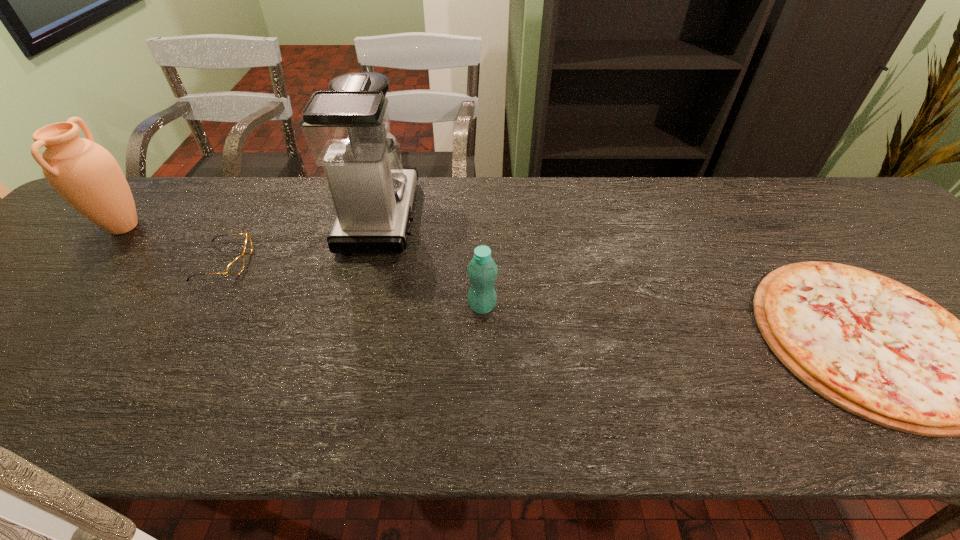
Where is `free space at the right edge`? free space at the right edge is located at coordinates coord(921,293).

This screenshot has width=960, height=540. What are the coordinates of `vacant point located between the urn and the fourth object from left to right` in the screenshot? It's located at (303, 267).

You are a GUI agent. You are given a task and a screenshot of the screen. Output one action in this format:
    pyautogui.click(x=<x>, y=<y>)
    Task: Click on the unoccupied area between the fourth shortest object and the second shortest object
    
    Given the screenshot: What is the action you would take?
    pyautogui.click(x=174, y=245)

Identify the location of free area in between the leftmost object and the water bottle. (303, 267).

Identify the location of vacant area between the tallest object and the leftmost object. Image resolution: width=960 pixels, height=540 pixels. (252, 221).

I want to click on empty location between the third tallest object and the fourth tallest object, so click(x=353, y=285).

This screenshot has height=540, width=960. Find the location of `free point between the coffee maker and the fourth object from left to right`. free point between the coffee maker and the fourth object from left to right is located at coordinates (431, 261).

Select which object is the second closest to the tallest object. Please provide its 2D coordinates. Your answer should be formatted as a tuple, i.e. [(x, y)], where the tuple contains the x and y coordinates of a point satisfying the conditions above.

[(235, 267)]

Identify the location of object that is the fourth closest one to the second shortest object. The width and height of the screenshot is (960, 540). (873, 346).

You are a GUI agent. You are given a task and a screenshot of the screen. Output one action in this format:
    pyautogui.click(x=<x>, y=<y>)
    Task: Click on the free location that satisfies the following two spatial constraints: 1. at the front of the third object from right to left where the controls are located; 2. on the front side of the fourth shortest object
    
    Given the screenshot: What is the action you would take?
    pyautogui.click(x=377, y=227)